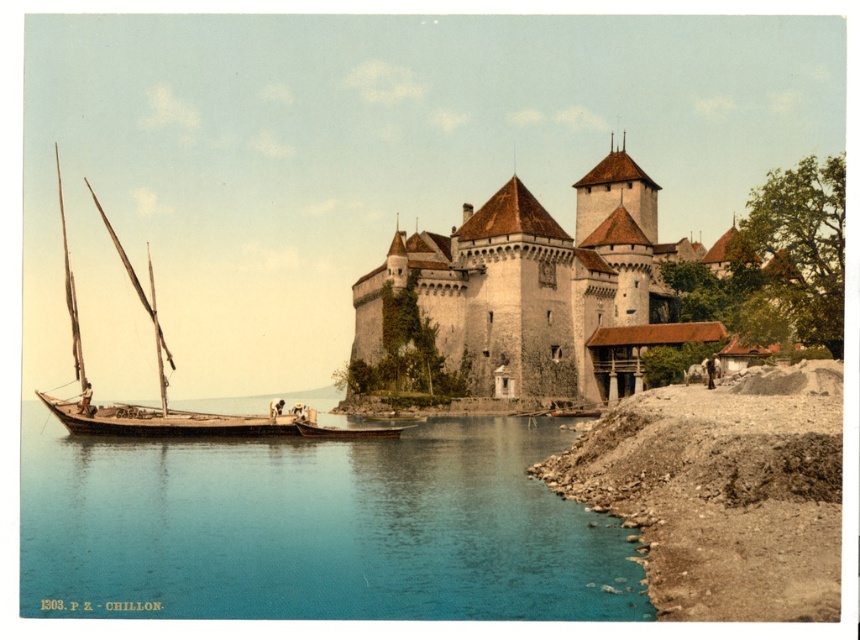
Does brown gravel shore at lower right appear under white stone castle at center?

Correct, brown gravel shore at lower right is located below white stone castle at center.

Which is in front, point (763, 380) or point (352, 289)?

Positioned in front is point (763, 380).

Which is behind, point (703, 465) or point (508, 269)?

Positioned behind is point (508, 269).

At what (x,y) coordinates should I click in order to perform the action: click on brown gravel shore at lower right. Please return your answer as a coordinate pair (x, y). This screenshot has height=640, width=860. Looking at the image, I should click on (723, 492).

Is point (250, 524) farther from camera compared to point (299, 426)?

No, it is not.

This screenshot has height=640, width=860. Describe the element at coordinates (314, 529) in the screenshot. I see `blue water at lower left` at that location.

Image resolution: width=860 pixels, height=640 pixels. I want to click on blue water at lower left, so click(314, 529).

Is point (708, 468) farther from viewer compared to point (321, 433)?

No, it is in front of (321, 433).

Does brown gravel shore at lower right have a lesser width compared to wooden planks boat at lower left?

Incorrect, brown gravel shore at lower right's width is not less than wooden planks boat at lower left's.

At what (x,y) coordinates should I click in order to perform the action: click on brown gravel shore at lower right. Please return your answer as a coordinate pair (x, y). The height and width of the screenshot is (640, 860). Looking at the image, I should click on (723, 492).

Find the location of a particular element. The height and width of the screenshot is (640, 860). brown gravel shore at lower right is located at coordinates (723, 492).